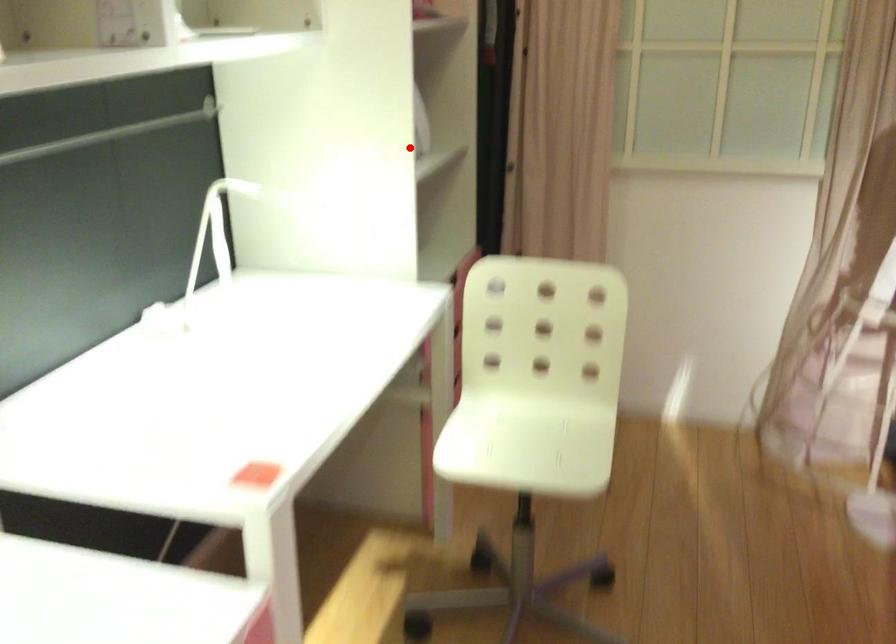
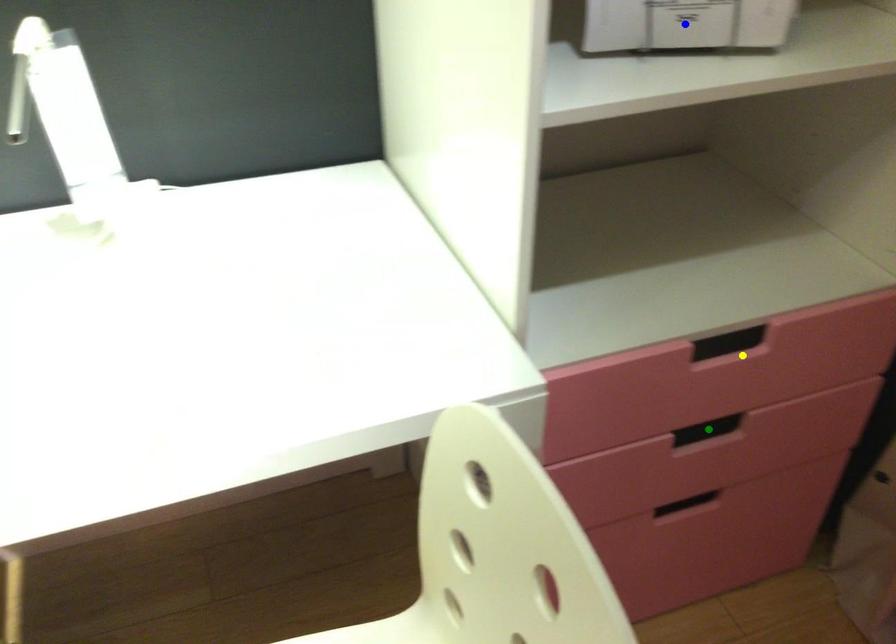
Question: I am providing you with two images of the same scene from different viewpoints. A red point is marked on the first image. You are given multiple points on the second image. In image 2, which mark is for the same physical point as the one in image 1?

Choices:
 (A) blue point
 (B) yellow point
 (C) green point

Answer: (A)